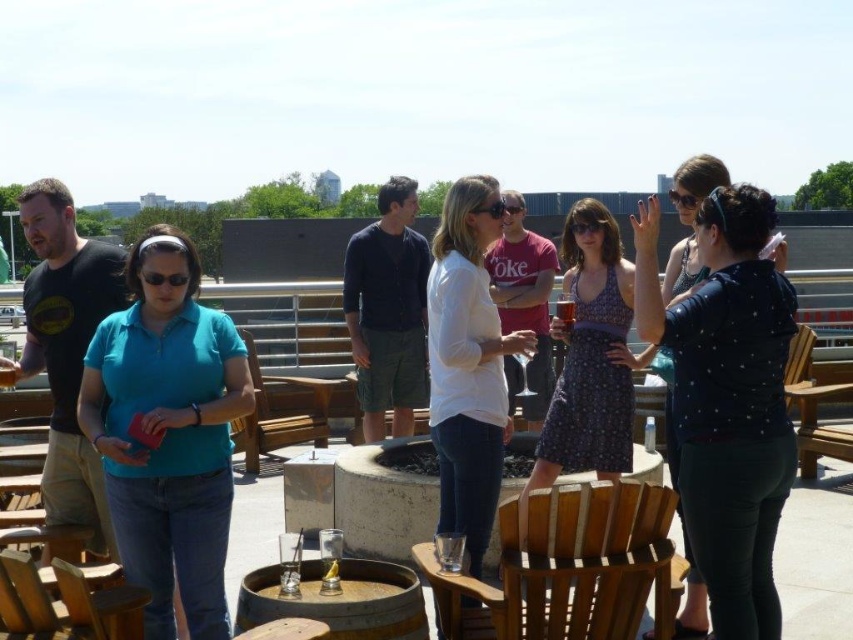
Question: Does teal fabric shirt at left have a larger size compared to teak wood chair at center?

Choices:
 (A) yes
 (B) no

Answer: (A)

Question: Does patterned fabric dress at center come behind wooden chair at center?

Choices:
 (A) yes
 (B) no

Answer: (B)

Question: Observing the image, what is the correct spatial positioning of matte black shirt at center in reference to patterned fabric dress at center?

Choices:
 (A) left
 (B) right

Answer: (B)

Question: Among these points, which one is farthest from the camera?

Choices:
 (A) (141, 612)
 (B) (766, 380)
 (C) (612, 323)

Answer: (C)

Question: Among these objects, which one is nearest to the camera?

Choices:
 (A) patterned fabric dress at center
 (B) white matte shirt at center

Answer: (B)

Question: Which point is closer to the camera?

Choices:
 (A) wooden chair at right
 (B) matte black shirt at center

Answer: (B)